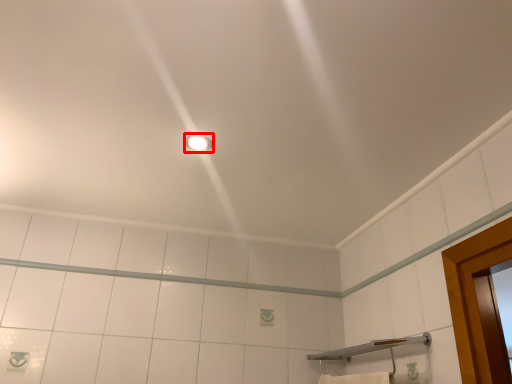
Question: From the image's perspective, what is the correct spatial relationship of light fixture (annotated by the red box) in relation to shower?

Choices:
 (A) below
 (B) above

Answer: (B)